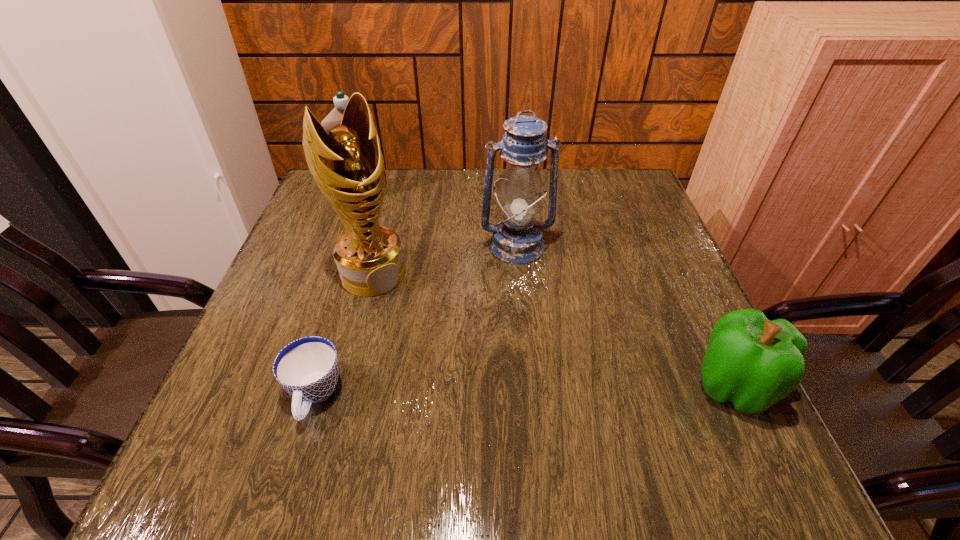
The height and width of the screenshot is (540, 960). In the image, there is a desktop. Find the location of `vacant space at the left edge`. vacant space at the left edge is located at coordinates (302, 328).

Find the location of a particular element. This screenshot has width=960, height=540. vacant space at the right edge of the desktop is located at coordinates (673, 354).

Locate an element on the screen. blank area at the far left corner is located at coordinates (321, 208).

Image resolution: width=960 pixels, height=540 pixels. Identify the location of vacant area at the far right corner. (622, 216).

This screenshot has width=960, height=540. Find the location of `free point at the near right corner`. free point at the near right corner is located at coordinates click(680, 395).

At what (x,y) coordinates should I click in order to perform the action: click on empty location between the second shortest object and the award. Please return your answer as a coordinate pair (x, y). The height and width of the screenshot is (540, 960). Looking at the image, I should click on (553, 329).

The image size is (960, 540). Identify the location of free space between the second shortest object and the lantern. (624, 315).

Locate an element on the screen. Image resolution: width=960 pixels, height=540 pixels. vacant area between the shortest object and the award is located at coordinates (344, 334).

Image resolution: width=960 pixels, height=540 pixels. In order to click on vacant point located between the rightmost object and the second object from right to left in this screenshot , I will do `click(624, 315)`.

This screenshot has width=960, height=540. What are the coordinates of `vacant space that's between the farthest object and the rightmost object` in the screenshot? It's located at (546, 289).